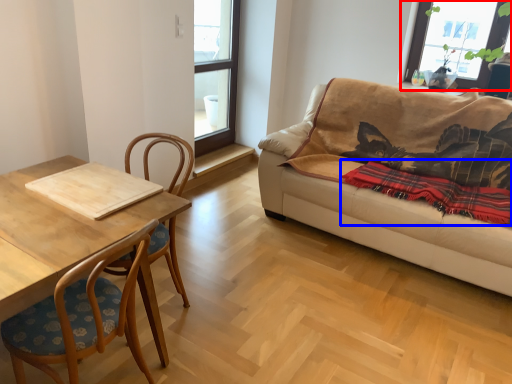
Question: Which object is further to the camera taking this photo, window (highlighted by a red box) or blanket (highlighted by a blue box)?

Choices:
 (A) window
 (B) blanket

Answer: (A)